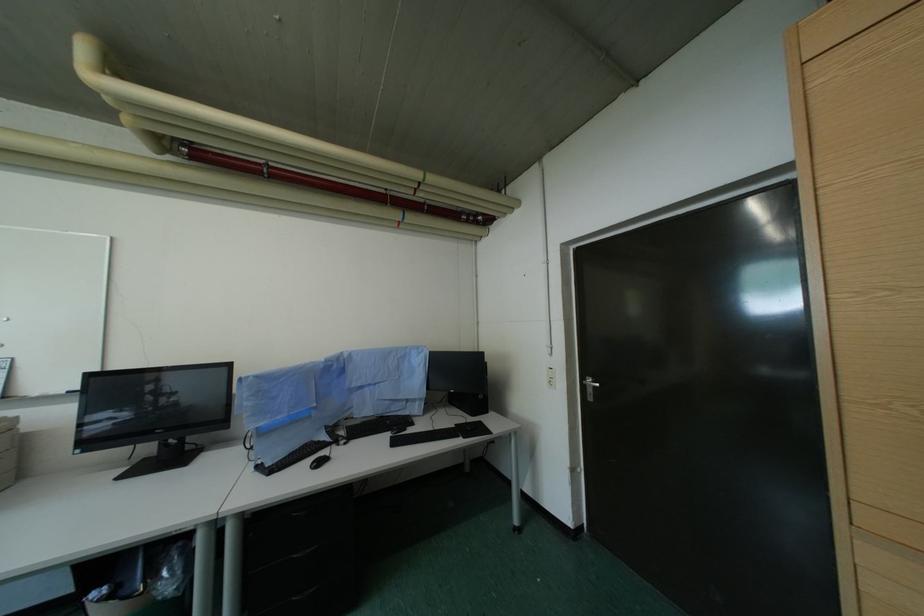
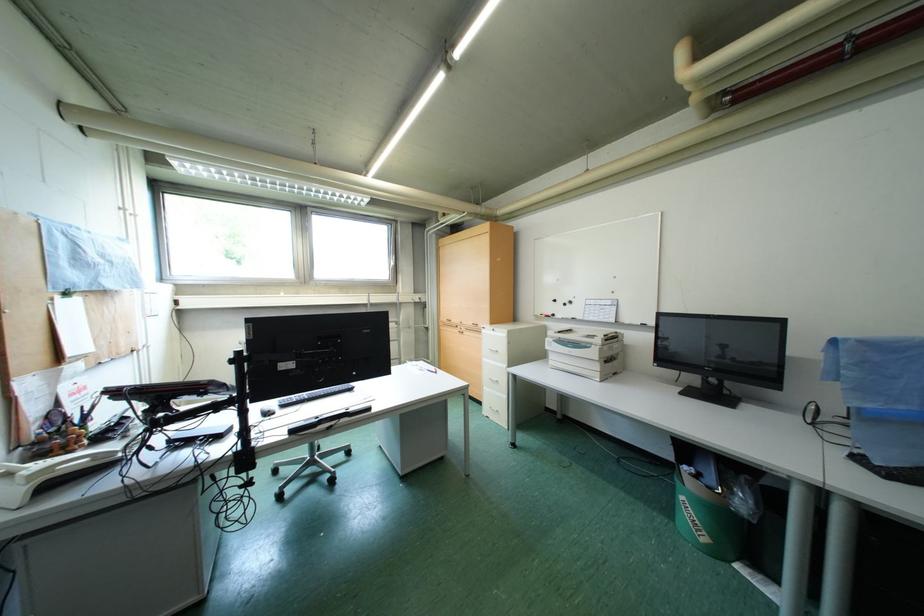
Question: The images are taken continuously from a first-person perspective. In which direction is your viewpoint rotating?

Choices:
 (A) Left
 (B) Right
 (C) Up
 (D) Down

Answer: (A)